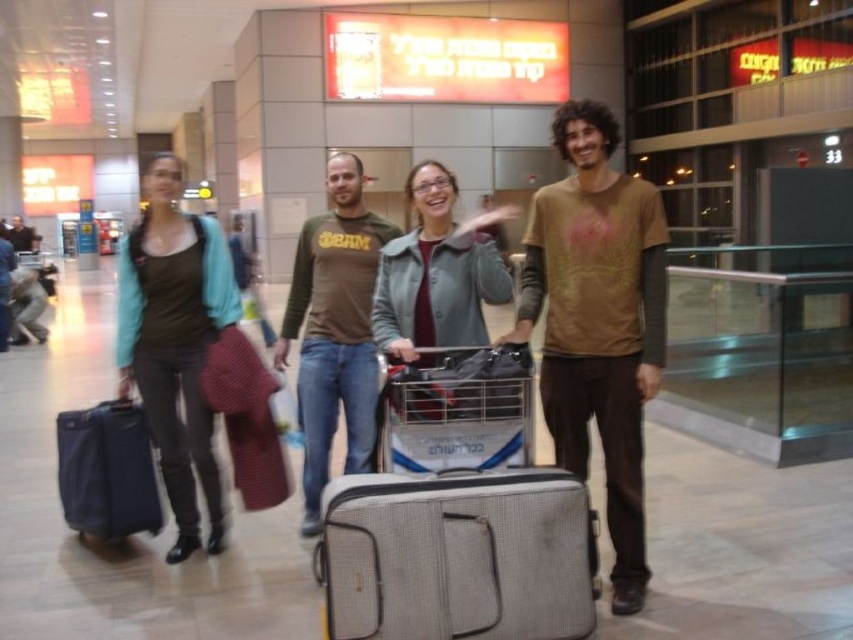
Does brown cotton shirt at center have a greater height compared to matte black jacket at left?

Indeed, brown cotton shirt at center has a greater height compared to matte black jacket at left.

The image size is (853, 640). Describe the element at coordinates (334, 330) in the screenshot. I see `brown cotton shirt at center` at that location.

You are a GUI agent. You are given a task and a screenshot of the screen. Output one action in this format:
    pyautogui.click(x=<x>, y=<y>)
    Task: Click on the brown cotton shirt at center
    
    Given the screenshot: What is the action you would take?
    pyautogui.click(x=334, y=330)

Is point (393, 356) behind point (142, 433)?

No.

Is matte gray jacket at center above matte blue suitcase at left?

Indeed, matte gray jacket at center is positioned over matte blue suitcase at left.

The height and width of the screenshot is (640, 853). Identify the location of matte gray jacket at center. tap(437, 276).

Image resolution: width=853 pixels, height=640 pixels. I want to click on matte gray jacket at center, so click(x=437, y=276).

Between brown textured t-shirt at center and matte blue suitcase at left, which one is positioned lower?

matte blue suitcase at left is lower down.

Is brown textured t-shirt at center smaller than matte blue suitcase at left?

No, brown textured t-shirt at center is not smaller than matte blue suitcase at left.

Consider the image. Who is more distant from viewer, (581, 244) or (115, 412)?

Positioned behind is point (115, 412).

Find the location of a particular element. brown textured t-shirt at center is located at coordinates (596, 321).